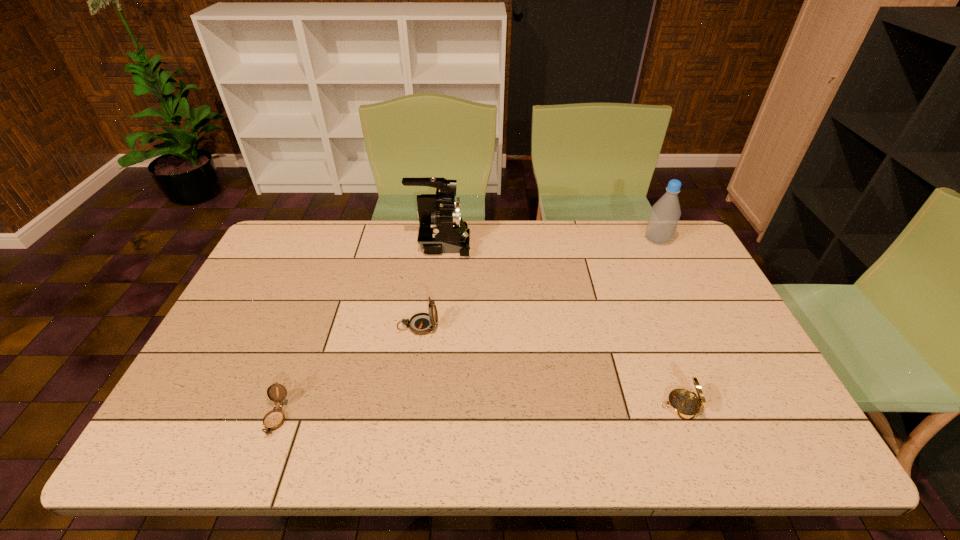
This screenshot has width=960, height=540. Find the location of `free space that satisfies the following two spatial constraints: 1. on the face of the third farthest object; 2. on the face of the shortest compass`. free space that satisfies the following two spatial constraints: 1. on the face of the third farthest object; 2. on the face of the shortest compass is located at coordinates (405, 418).